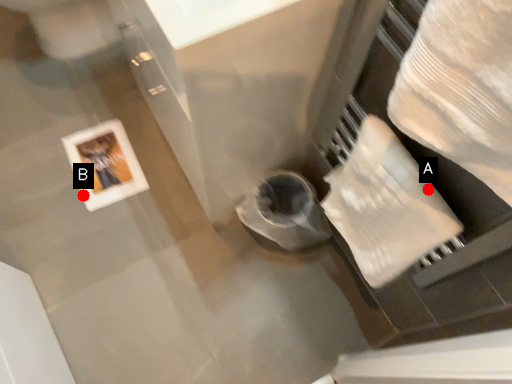
Question: Two points are circled on the image, labeled by A and B beside each circle. Which point is farther from the camera taking this photo?

Choices:
 (A) A is further
 (B) B is further

Answer: (B)